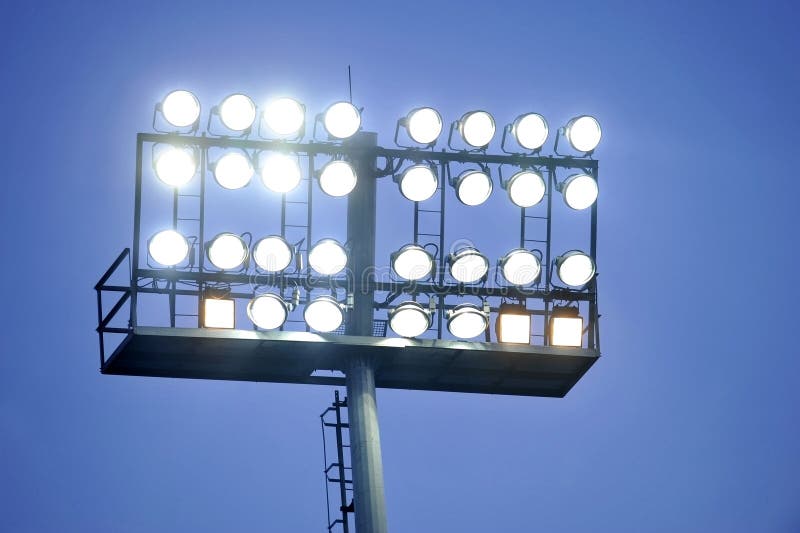
Identify the location of bottom row of lights. (222, 320), (262, 317), (322, 322), (397, 325), (458, 326), (512, 329), (566, 339).